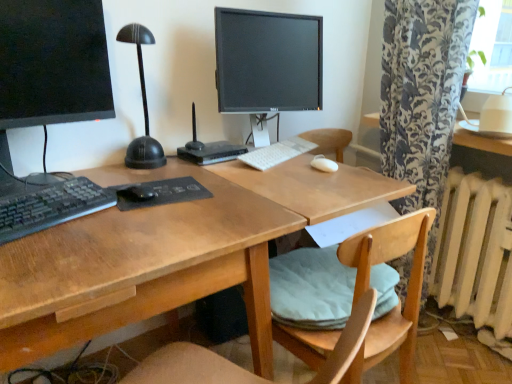
Identify the location of vacant area to the left of white matte mouse at center. The image size is (512, 384). (276, 162).